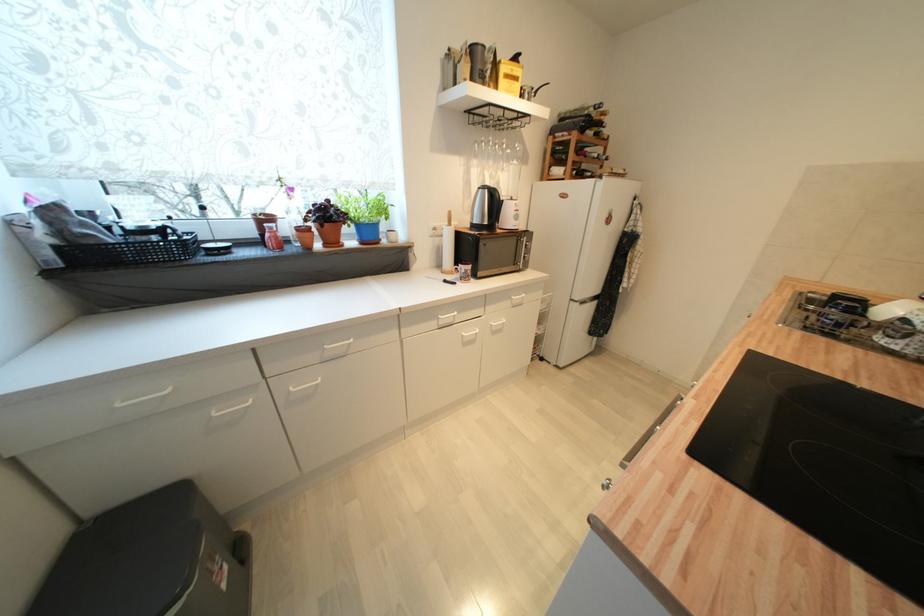
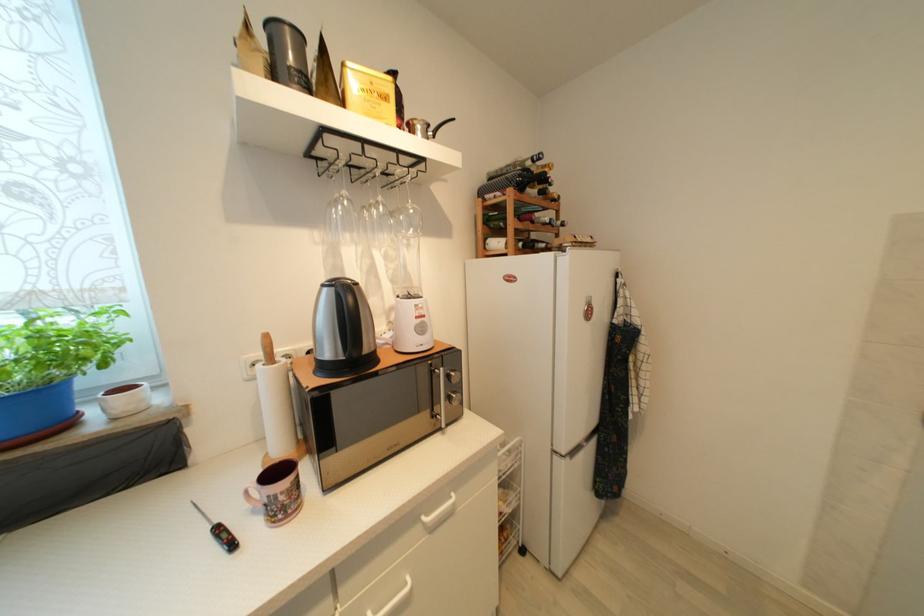
Question: Based on the continuous images, in which direction is the camera rotating? Reply with the corresponding letter.

Choices:
 (A) Left
 (B) Right
 (C) Up
 (D) Down

Answer: (C)